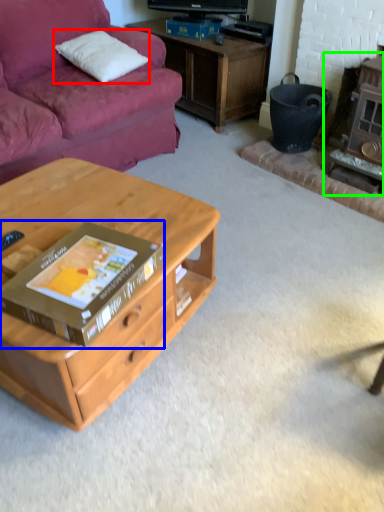
Question: Considering the real-world distances, which object is closest to pillow (highlighted by a red box)? box (highlighted by a blue box) or fireplace (highlighted by a green box).

Choices:
 (A) box
 (B) fireplace

Answer: (B)